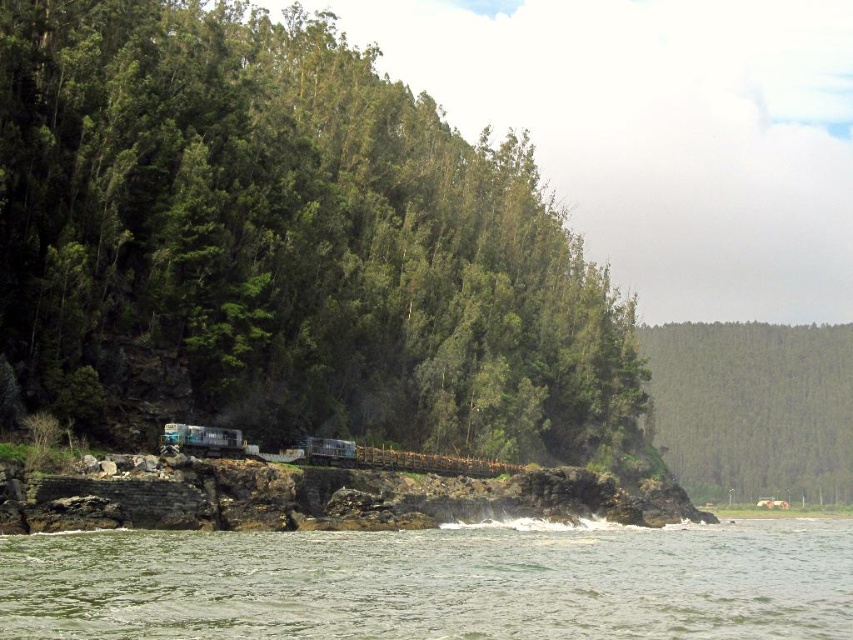
You are planning to build a small garden between the green leafy trees at left and the clear water at lower left. Given that the garden requires a space of 150 feet, will there be enough space between them?

The distance between the green leafy trees at left and the clear water at lower left is 146.02 feet, which is less than the required 150 feet. Therefore, there is not enough space for the garden.

In the scene shown: You are a hiker who wants to cross from the clear water at lower left to the metallic blue train at center. Can you safely walk directly between them?

The distance between clear water at lower left and metallic blue train at center is 26.59 meters. Since the path between them is not mentioned as obstructed, you can safely walk directly between them.